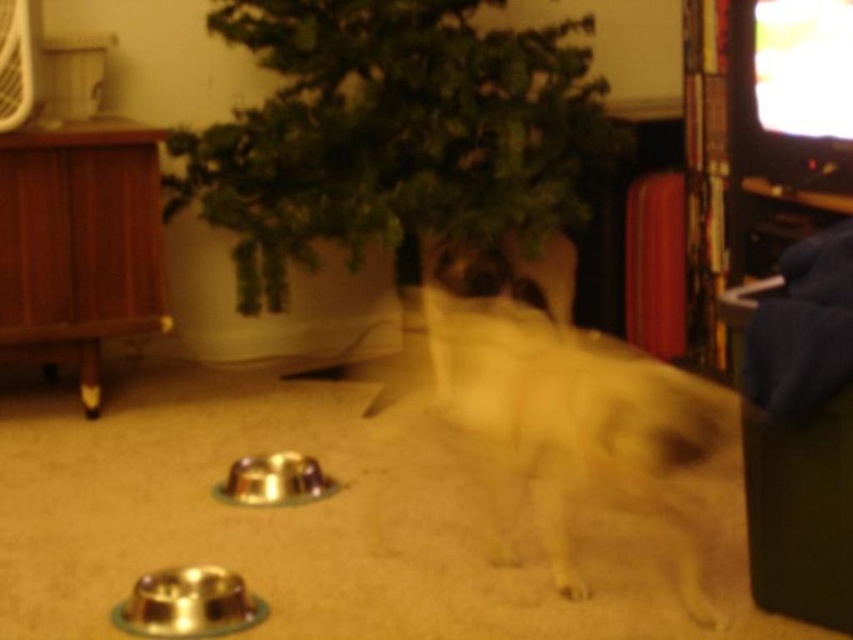
Question: Can you confirm if green leafy plant at center is wider than white fur dog at center?

Choices:
 (A) yes
 (B) no

Answer: (A)

Question: Is green leafy plant at center to the left of white fur dog at center from the viewer's perspective?

Choices:
 (A) yes
 (B) no

Answer: (A)

Question: Is green leafy plant at center positioned at the back of white fur dog at center?

Choices:
 (A) yes
 (B) no

Answer: (A)

Question: Which object is closer to the camera taking this photo?

Choices:
 (A) white fur dog at center
 (B) green leafy plant at center

Answer: (A)